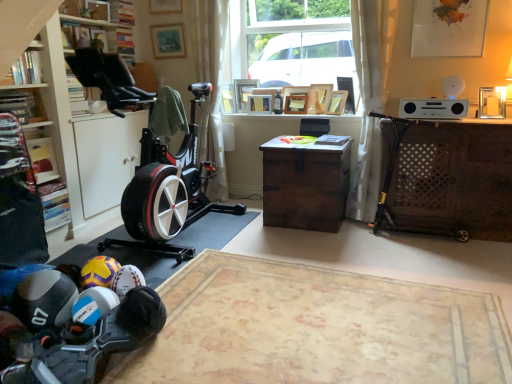
This screenshot has width=512, height=384. Identify the location of vacant area located to the right-hand side of white matte baseball at lower left, which is counted as the first toy, starting from the back. 174,299.